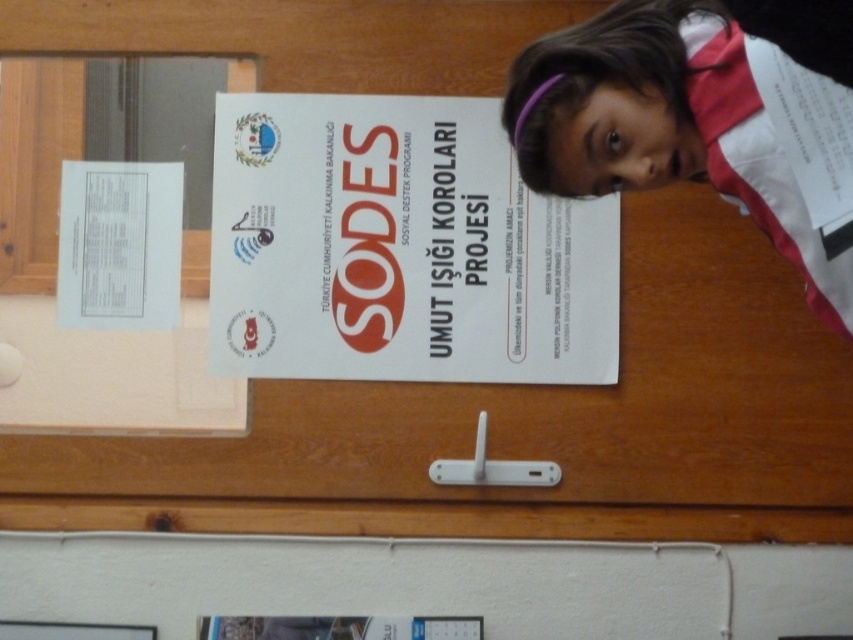
Between white fabric headband at upper right and white paper at upper left, which one appears on the left side from the viewer's perspective?

white paper at upper left

Measure the distance between point (531,184) and camera.

A distance of 5.17 feet exists between point (531,184) and camera.

Is point (720, 56) positioned behind point (100, 218)?

No, it is not.

Locate an element on the screen. This screenshot has width=853, height=640. white fabric headband at upper right is located at coordinates (665, 125).

Where is `white paper poster at center`? white paper poster at center is located at coordinates (399, 248).

You are a GUI agent. You are given a task and a screenshot of the screen. Output one action in this format:
    pyautogui.click(x=<x>, y=<y>)
    Task: Click on the white paper poster at center
    
    Given the screenshot: What is the action you would take?
    pyautogui.click(x=399, y=248)

Between point (248, 355) and point (73, 262), which one is positioned in front?

Point (248, 355) is more forward.

Which is above, white paper poster at center or white paper at upper left?

white paper at upper left is higher up.

Is point (328, 198) less distant than point (177, 177)?

No, it is behind (177, 177).

You are a GUI agent. You are given a task and a screenshot of the screen. Output one action in this format:
    pyautogui.click(x=<x>, y=<y>)
    Task: Click on the white paper poster at center
    The image size is (853, 640).
    Given the screenshot: What is the action you would take?
    pyautogui.click(x=399, y=248)